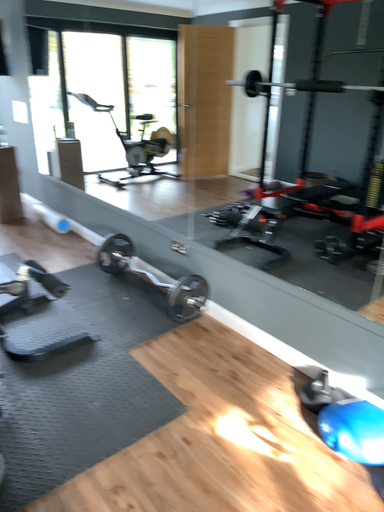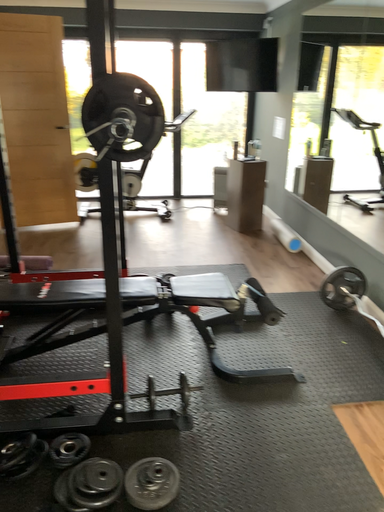
Question: How did the camera likely rotate when shooting the video?

Choices:
 (A) rotated left
 (B) rotated right

Answer: (A)